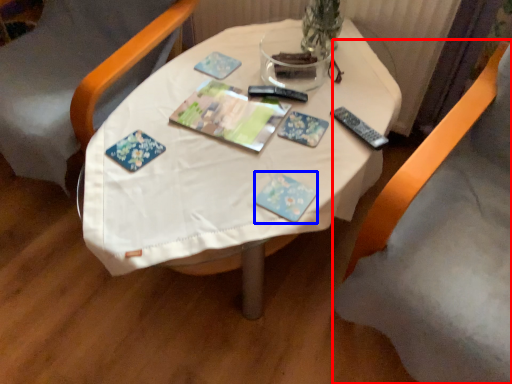
Question: Which of the following is the closest to the observer, chair (highlighted by a red box) or paperback book (highlighted by a blue box)?

Choices:
 (A) chair
 (B) paperback book

Answer: (A)